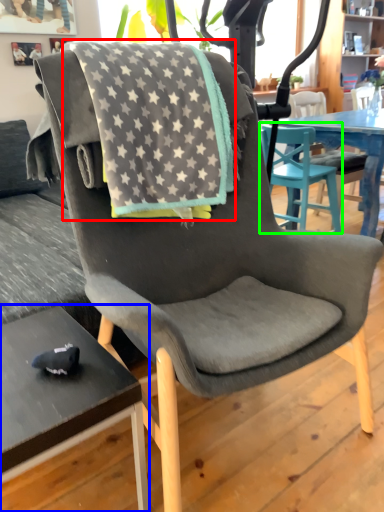
Question: Estimate the real-world distances between objects in this image. Which object is closer to beach towel (highlighted by a red box), desk (highlighted by a blue box) or chair (highlighted by a green box)?

Choices:
 (A) desk
 (B) chair

Answer: (A)